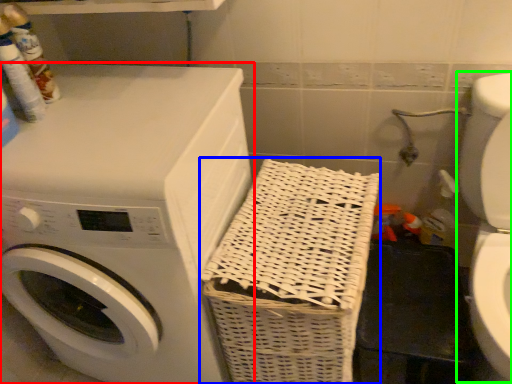
Question: Estimate the real-world distances between objects in this image. Which object is farther from washing machine (highlighted by a red box), basket (highlighted by a blue box) or washer (highlighted by a green box)?

Choices:
 (A) basket
 (B) washer

Answer: (B)